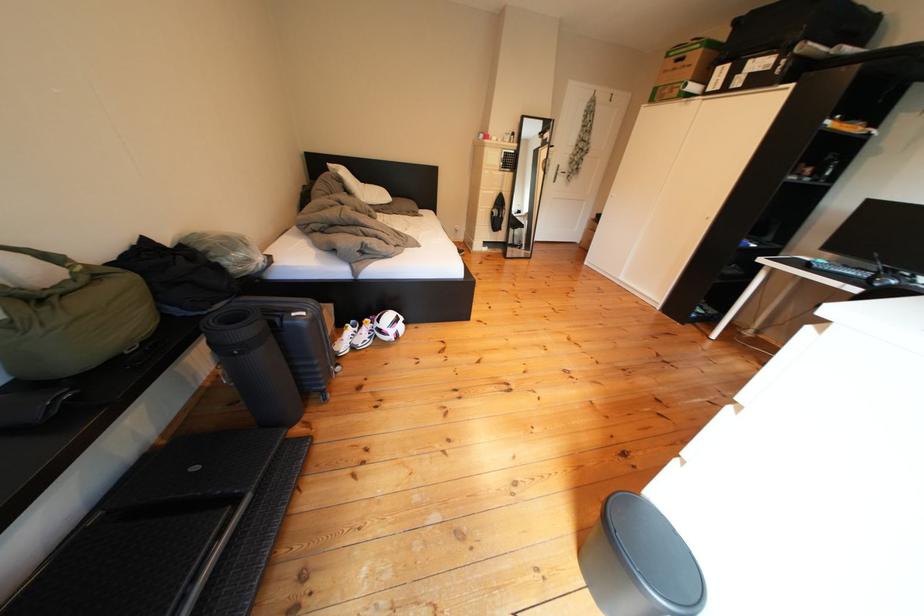
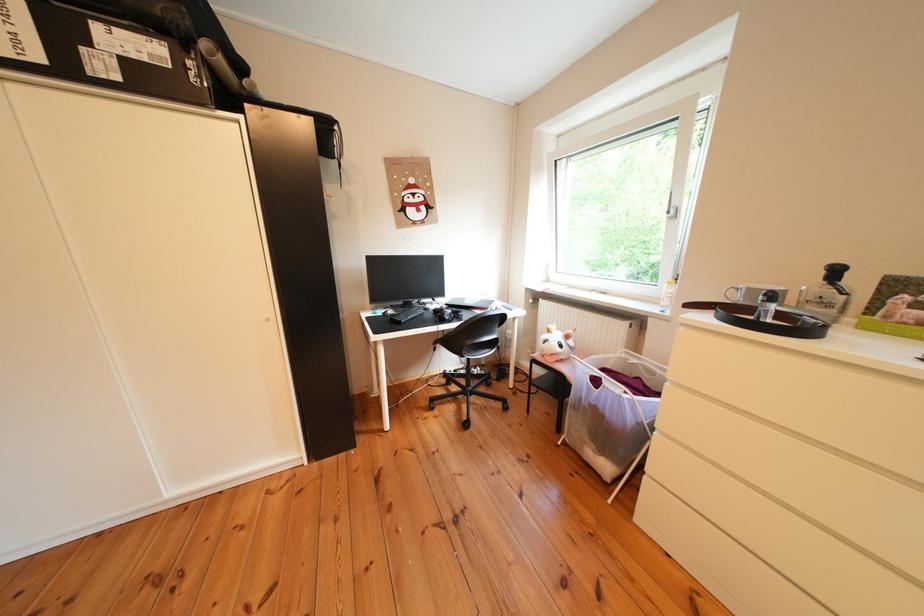
Find the pixel in the second image that matches [755,90] in the first image.

(131, 83)